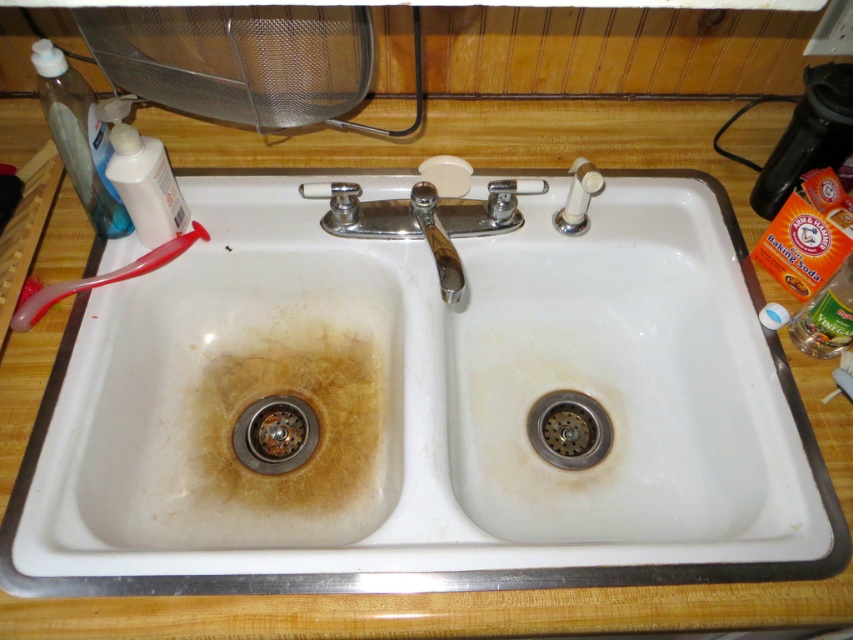
You are a plumber inspecting the kitchen sink. You notice the white ceramic sink at center and the rusty metal drain at lower left. Which object is nearer to your current position?

The white ceramic sink at center is closer to the viewer than the rusty metal drain at lower left, so the white ceramic sink at center is nearer to your current position.

As a kitchen designer, you need to place a new spice rack on the countertop near the sink. The coordinates of the sink are given as point (436, 406). Where should you place the spice rack relative to the sink to ensure it is within easy reach but not directly over the sink itself?

The white ceramic sink at center is represented by point (436, 406). To place the spice rack near but not over the sink, position it slightly to the side or behind the sink coordinates, maintaining a close proximity for easy access while avoiding the exact sink location.